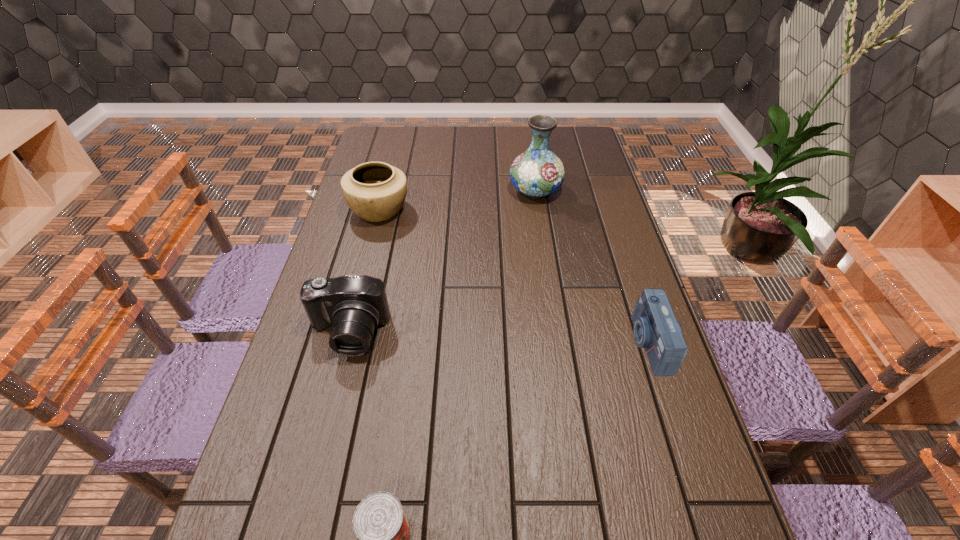
Locate an element on the screen. This screenshot has width=960, height=540. blank area located 0.180m on the lens of the shorter camera is located at coordinates (563, 343).

Where is `vacant point located 0.360m on the lens of the shorter camera`? The image size is (960, 540). vacant point located 0.360m on the lens of the shorter camera is located at coordinates (491, 343).

Identify the location of pottery that is positioned at the left edge. This screenshot has height=540, width=960. (375, 191).

You are a GUI agent. You are given a task and a screenshot of the screen. Output one action in this format:
    pyautogui.click(x=<x>, y=<y>)
    Task: Click on the camera present at the left edge
    
    Given the screenshot: What is the action you would take?
    pyautogui.click(x=354, y=305)

Find the location of a particular element. object situated at the right edge is located at coordinates 656,329.

Identify the location of free location at the far edge. This screenshot has height=540, width=960. (425, 134).

At what (x,y) coordinates should I click in order to perform the action: click on vacant space at the right edge of the desktop. Please return your answer as a coordinate pair (x, y). This screenshot has width=960, height=540. Looking at the image, I should click on (600, 335).

Image resolution: width=960 pixels, height=540 pixels. In order to click on vacant point at the far left corner in this screenshot , I will do `click(405, 129)`.

Where is `empty space between the vase and the left camera`? empty space between the vase and the left camera is located at coordinates (442, 262).

You are a GUI agent. You are given a task and a screenshot of the screen. Output one action in this format:
    pyautogui.click(x=<x>, y=<y>)
    Task: Click on the free space between the right camera and the pottery
    This screenshot has width=960, height=540.
    Given the screenshot: What is the action you would take?
    pyautogui.click(x=515, y=276)